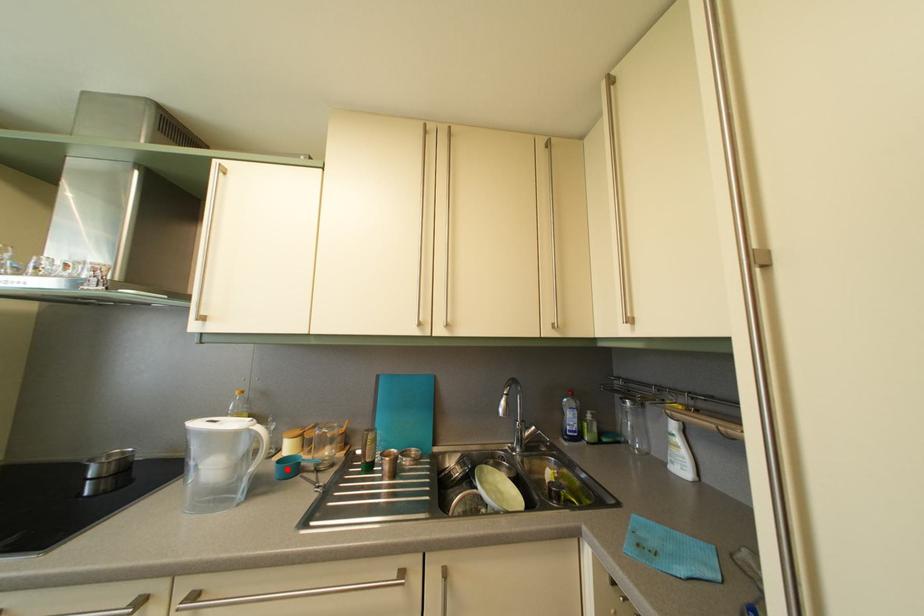
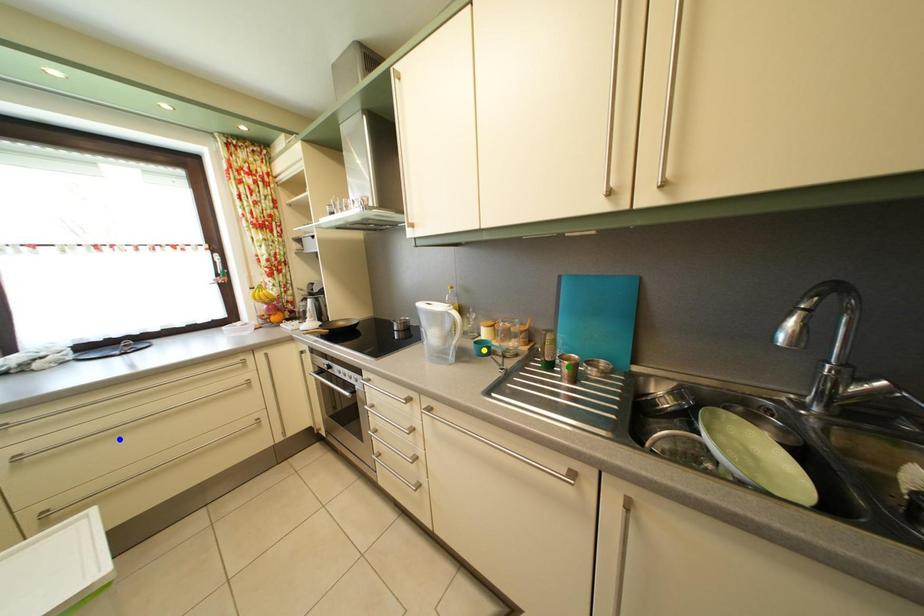
Question: I am providing you with two images of the same scene from different viewpoints. A red point is marked on the first image. You are given multiple points on the second image. In image 2, which mark is for the same physical point as the one in image 1?

Choices:
 (A) green point
 (B) blue point
 (C) yellow point

Answer: (C)